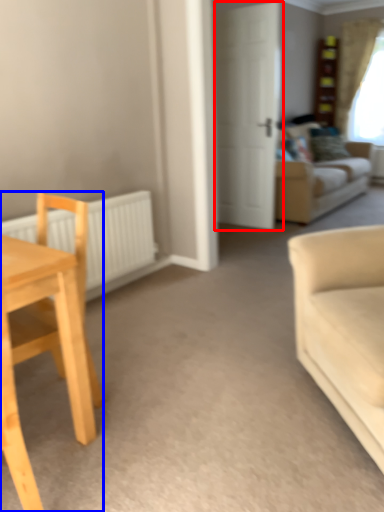
Question: Which of the following is the closest to the observer, door (highlighted by a red box) or chair (highlighted by a blue box)?

Choices:
 (A) door
 (B) chair

Answer: (B)